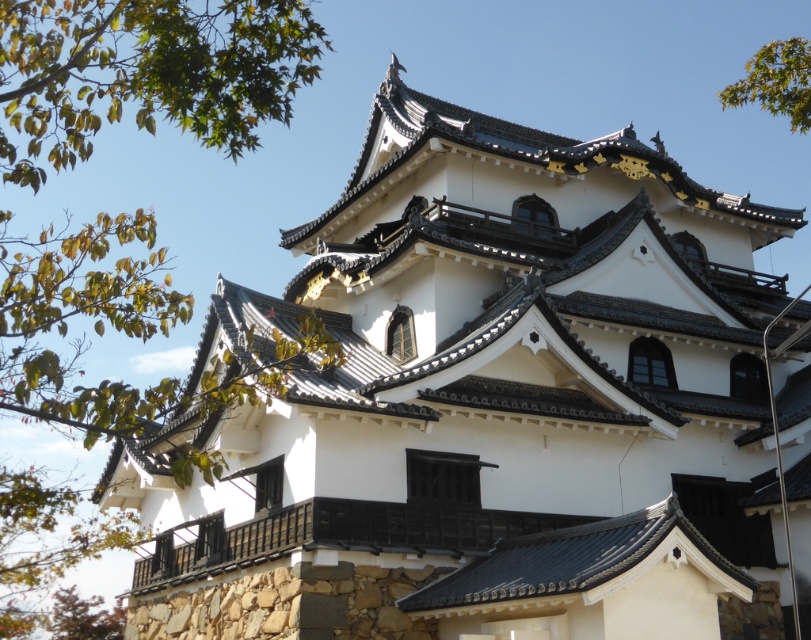
Which is below, green leafy tree at upper left or green leafy tree at upper right?

green leafy tree at upper left

Who is positioned more to the left, green leafy tree at upper left or green leafy tree at upper right?

From the viewer's perspective, green leafy tree at upper left appears more on the left side.

I want to click on green leafy tree at upper left, so click(x=144, y=72).

This screenshot has height=640, width=811. What are the coordinates of `green leafy tree at upper left` in the screenshot? It's located at click(144, 72).